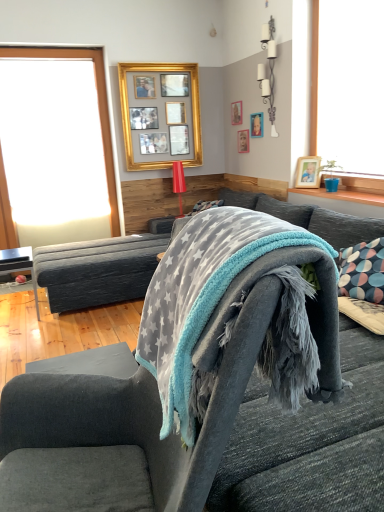
Question: Considering the positions of gray star-patterned towel at center and gold metallic picture frame at upper center, which is the first picture frame from left to right, in the image, is gray star-patterned towel at center wider or thinner than gold metallic picture frame at upper center, which is the first picture frame from left to right,?

Choices:
 (A) thin
 (B) wide

Answer: (B)

Question: Considering the positions of point (188, 253) and point (195, 141), is point (188, 253) closer or farther from the camera than point (195, 141)?

Choices:
 (A) farther
 (B) closer

Answer: (B)

Question: Based on their relative distances, which object is nearer to the brushed metal table at lower left?

Choices:
 (A) white glass window at left
 (B) wooden picture frame at upper center, the 4th picture frame viewed from the right
 (C) velvet grey armchair at center
 (D) wooden picture frame at upper center, which is the 2th picture frame in right-to-left order
 (E) gold metallic picture frame at upper center, the fifth picture frame positioned from the right

Answer: (A)

Question: Estimate the real-world distances between objects in this image. Which object is closer to the gold metallic picture frame at upper center, which is the first picture frame from left to right?

Choices:
 (A) wooden picture frame at upper center, the fourth picture frame when ordered from left to right
 (B) gray star-patterned towel at center
 (C) velvet grey couch at center
 (D) wooden picture frame at upper center, marked as the third picture frame in a left-to-right arrangement
 (E) wooden picture frame at upper right, which is the 5th picture frame in left-to-right order

Answer: (D)